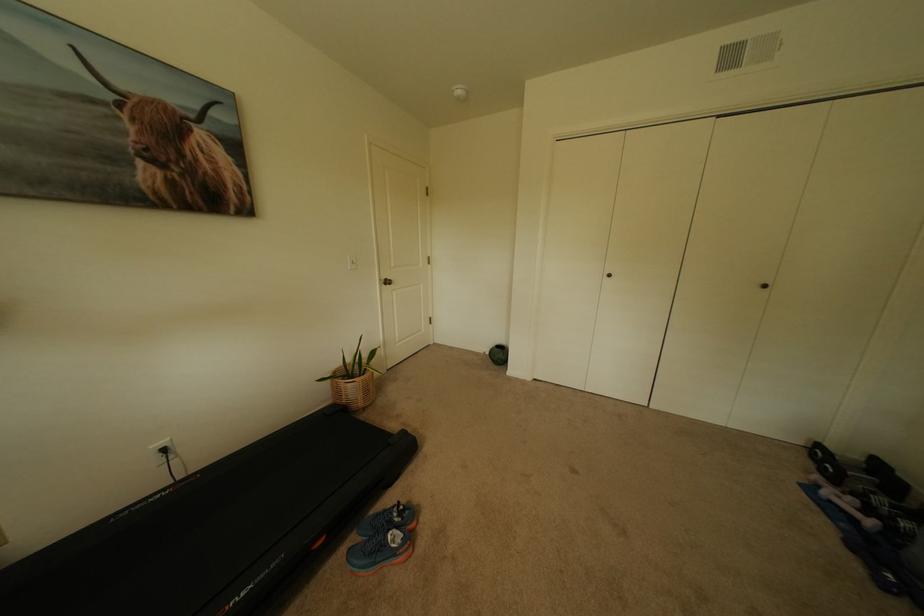
The image size is (924, 616). I want to click on white dumbbell, so click(x=849, y=507).